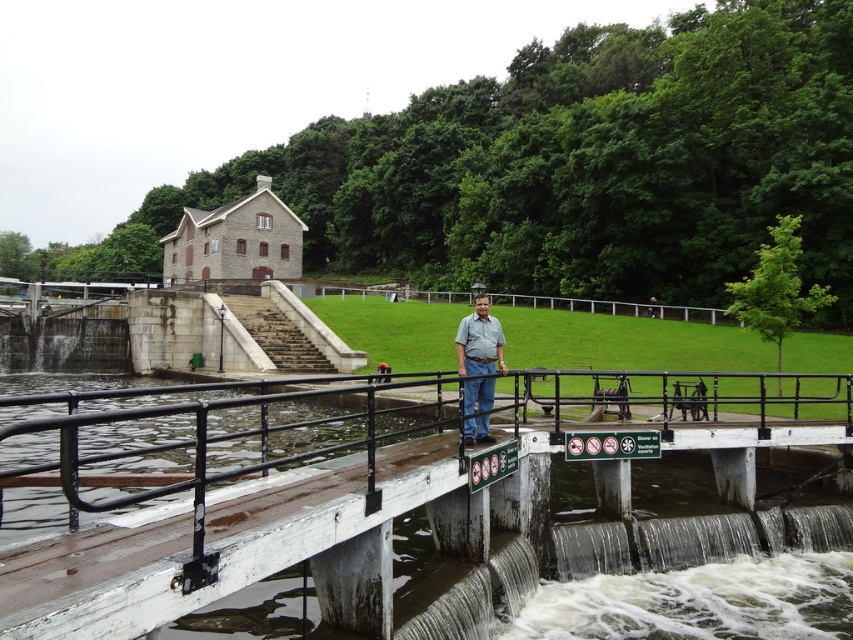
Which of these two, white painted wood rail at center or green fabric shirt at center, stands shorter?

green fabric shirt at center

Is white painted wood rail at center below green fabric shirt at center?

Yes.

This screenshot has height=640, width=853. Identify the location of white painted wood rail at center. (763, 413).

Locate an element on the screen. Image resolution: width=853 pixels, height=640 pixels. white painted wood rail at center is located at coordinates (763, 413).